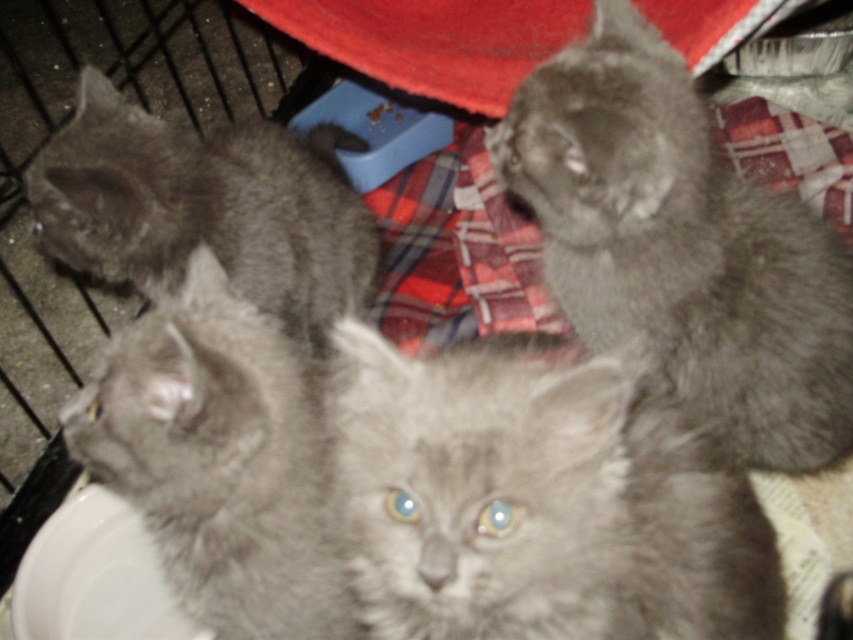
Question: In this image, where is fluffy gray kitten at center located relative to white glossy plate at lower left?

Choices:
 (A) right
 (B) left

Answer: (A)

Question: Can you confirm if fluffy gray kitten at center is thinner than fluffy gray cat at lower left?

Choices:
 (A) no
 (B) yes

Answer: (A)

Question: Can you confirm if fluffy gray kitten at center is wider than gray fluffy cat at left?

Choices:
 (A) no
 (B) yes

Answer: (B)

Question: Which object is positioned farthest from the fluffy gray kitten at center?

Choices:
 (A) fluffy gray cat at upper right
 (B) fluffy gray cat at lower left
 (C) white glossy plate at lower left

Answer: (C)

Question: Which point appears closest to the camera in this image?

Choices:
 (A) (308, 193)
 (B) (566, 211)
 (C) (132, 580)

Answer: (B)

Question: Estimate the real-world distances between objects in this image. Which object is closer to the fluffy gray kitten at center?

Choices:
 (A) fluffy gray cat at upper right
 (B) white glossy plate at lower left
 (C) gray fluffy cat at left
 (D) fluffy gray cat at lower left

Answer: (D)